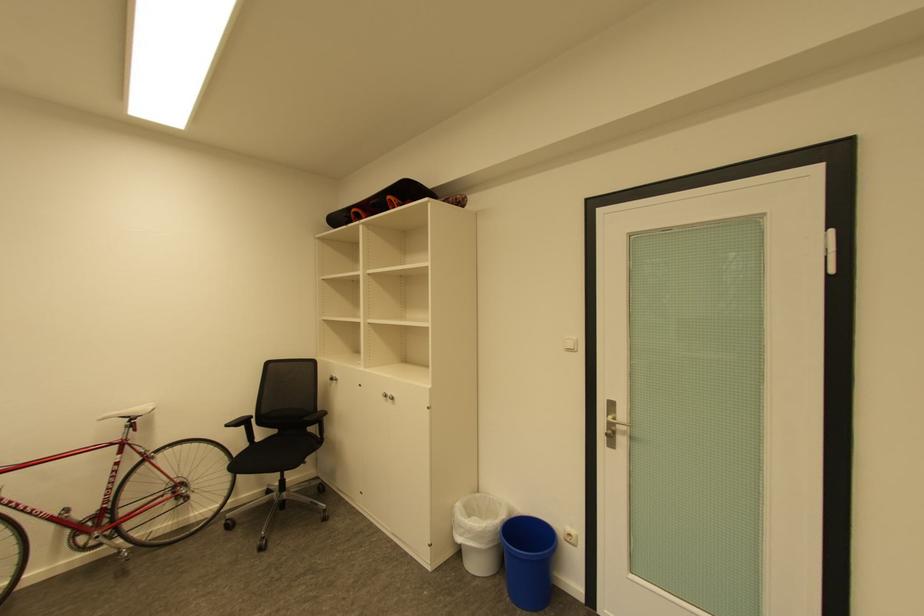
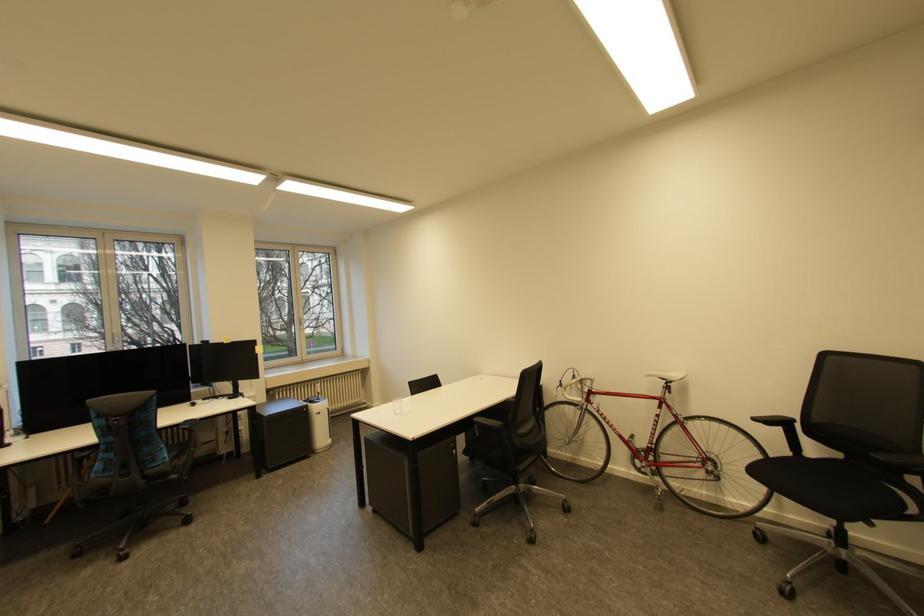
Question: The first image is from the beginning of the video and the second image is from the end. How did the camera likely rotate when shooting the video?

Choices:
 (A) Left
 (B) Right
 (C) Up
 (D) Down

Answer: (A)